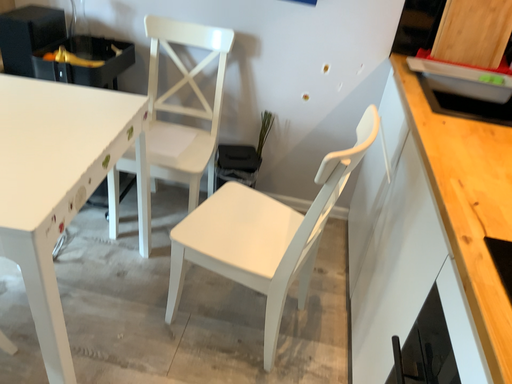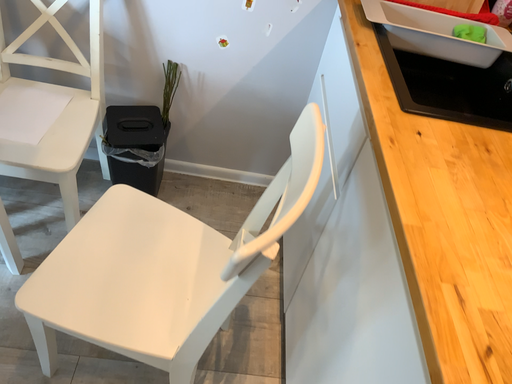
Question: How did the camera likely rotate when shooting the video?

Choices:
 (A) rotated upward
 (B) rotated downward

Answer: (B)